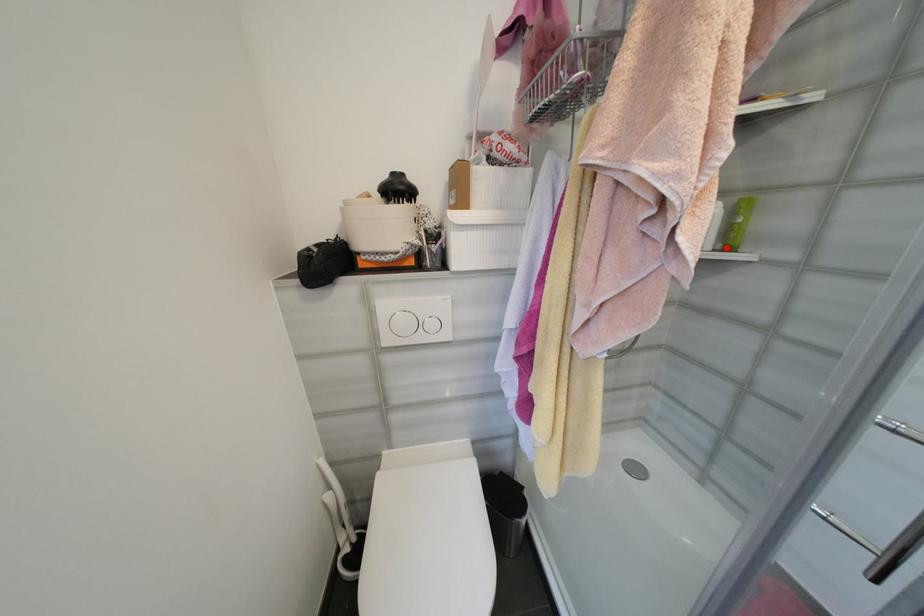
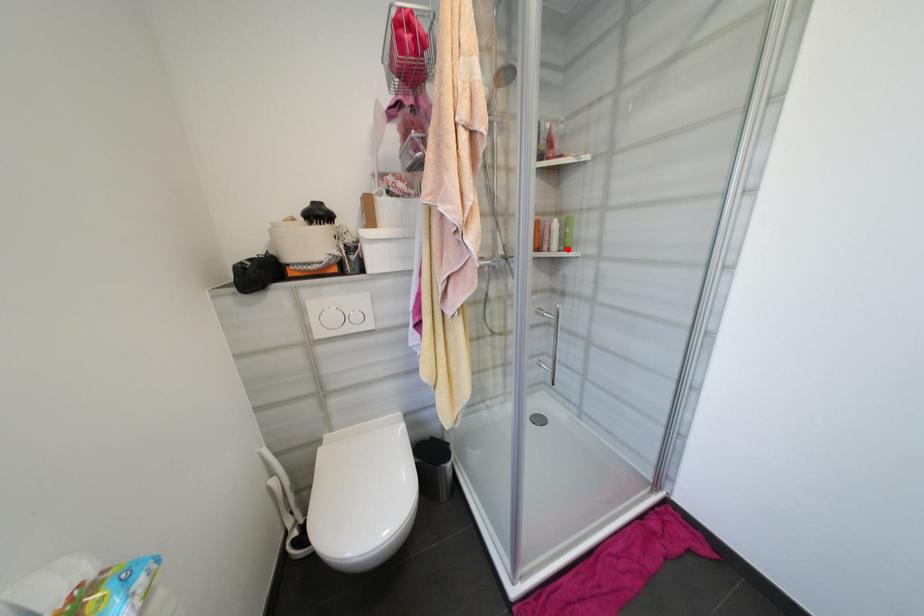
I am providing you with two images of the same scene from different viewpoints. A red point is marked on the first image and another point is marked on the second image. Are the points marked in image1 and image2 representing the same 3D position?

Yes